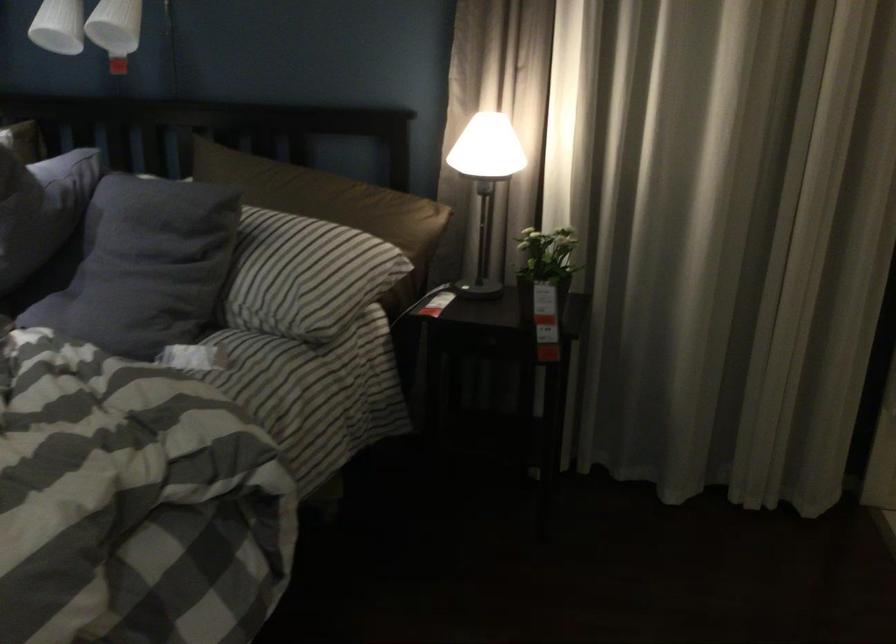
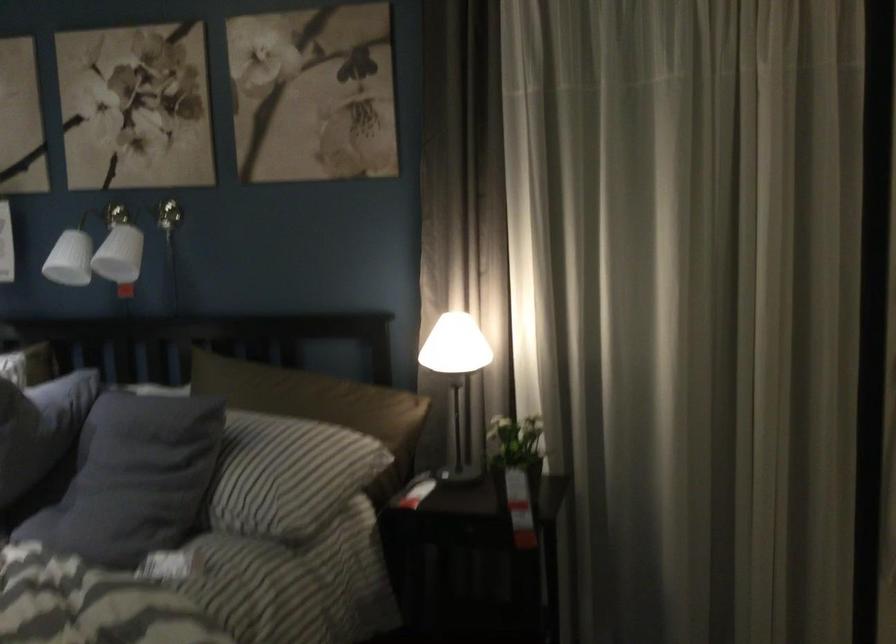
Find the pixel in the second image that matches point 546,263 in the first image.

(515, 451)